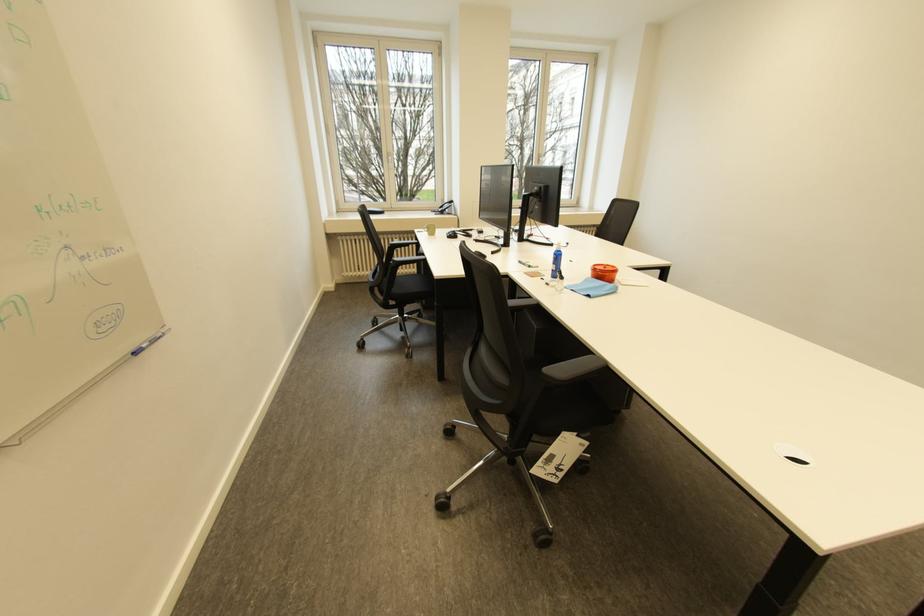
The height and width of the screenshot is (616, 924). In order to click on phone handset in this screenshot , I will do `click(462, 232)`.